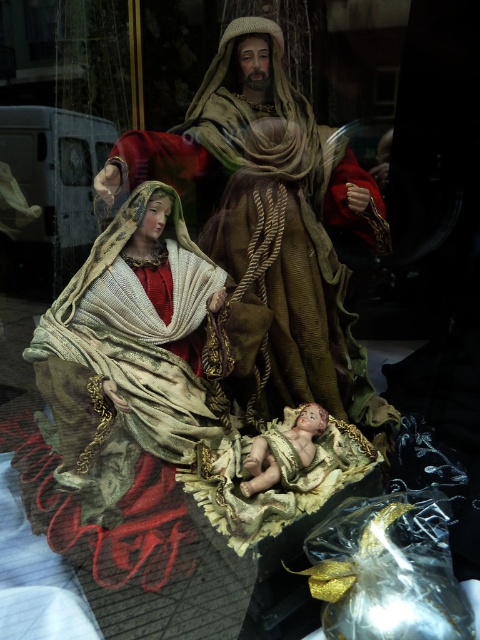
This screenshot has width=480, height=640. Describe the element at coordinates (285, 211) in the screenshot. I see `velvet brown robe at center` at that location.

Find the location of a particular element. The image size is (480, 640). velvet brown robe at center is located at coordinates (285, 211).